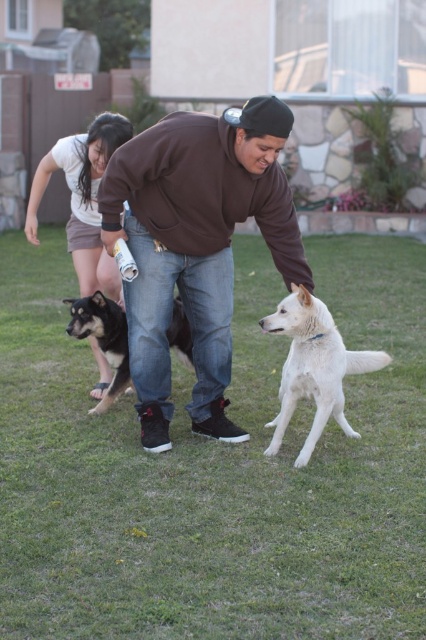
Question: Which of the following is the farthest from the observer?

Choices:
 (A) white cotton shorts at lower left
 (B) green grass at center
 (C) white fur dog at center

Answer: (A)

Question: Which point is farther from the camera taking this photo?

Choices:
 (A) (354, 602)
 (B) (98, 403)
 (C) (111, 275)
 (D) (230, 435)

Answer: (C)

Question: Is brown cotton sweatshirt at center bigger than black fur dog at center?

Choices:
 (A) yes
 (B) no

Answer: (A)

Question: Does green grass at center appear over white cotton shorts at lower left?

Choices:
 (A) yes
 (B) no

Answer: (B)

Question: Which point appears closest to the camera in this image?

Choices:
 (A) (75, 301)
 (B) (284, 300)
 (C) (149, 586)
 (D) (66, 138)

Answer: (C)

Question: Is white cotton shorts at lower left further to camera compared to black fur dog at center?

Choices:
 (A) no
 (B) yes

Answer: (B)